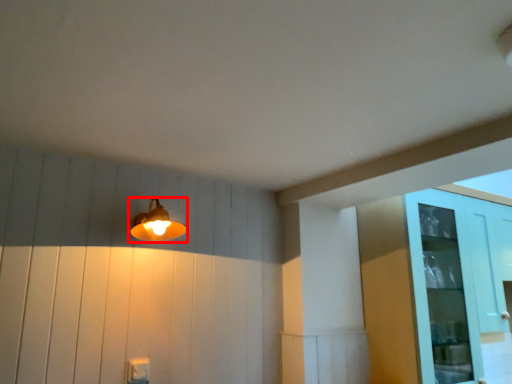
Question: Considering the relative positions of lamp (annotated by the red box) and glass door in the image provided, where is lamp (annotated by the red box) located with respect to the staircase?

Choices:
 (A) left
 (B) right

Answer: (A)